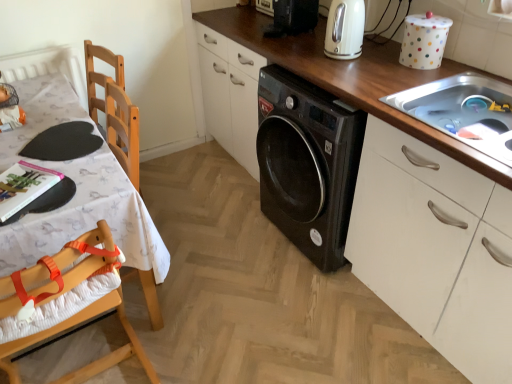
Identify the location of free spot below black plastic washing machine at upper center, which is counted as the first appliance, starting from the left (from a real-world perspective). The image size is (512, 384). (292, 32).